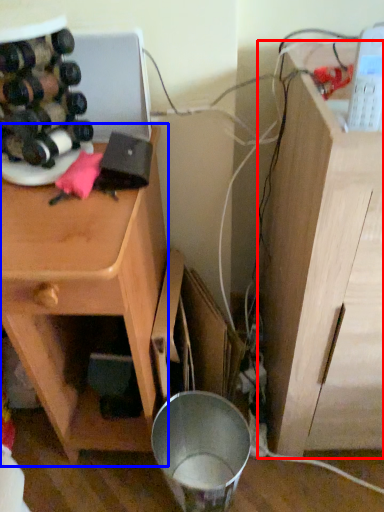
Question: Which point is further to the camera, vanity (highlighted by a red box) or cabinetry (highlighted by a blue box)?

Choices:
 (A) vanity
 (B) cabinetry

Answer: (B)